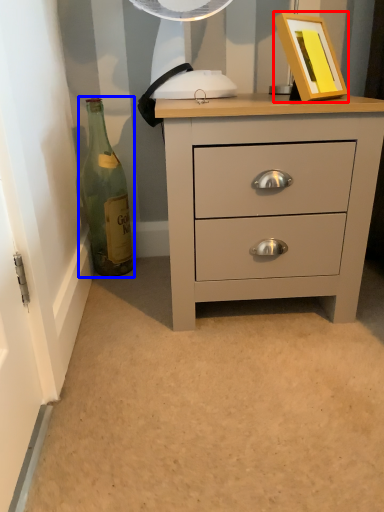
Question: Among these objects, which one is farthest to the camera, picture frame (highlighted by a red box) or bottle (highlighted by a blue box)?

Choices:
 (A) picture frame
 (B) bottle

Answer: (B)